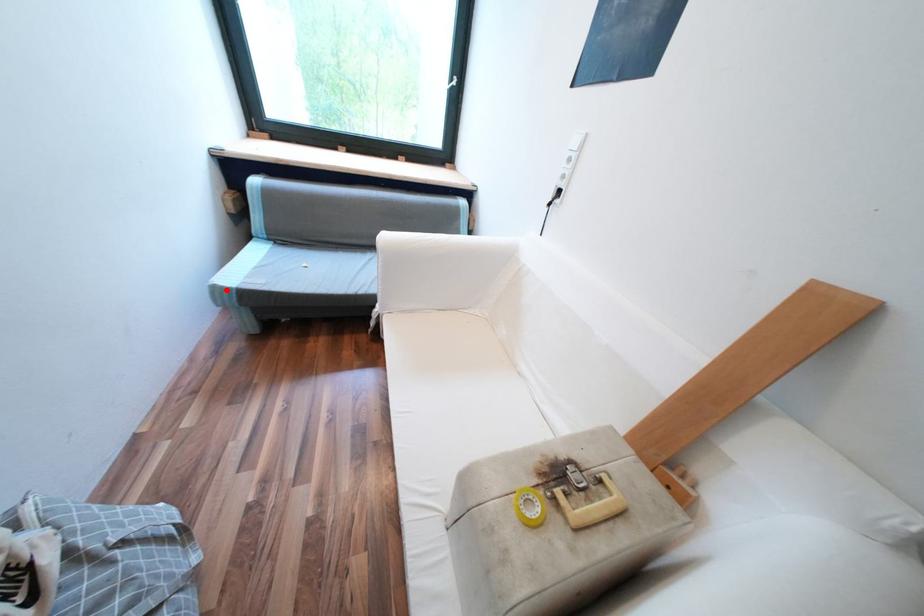
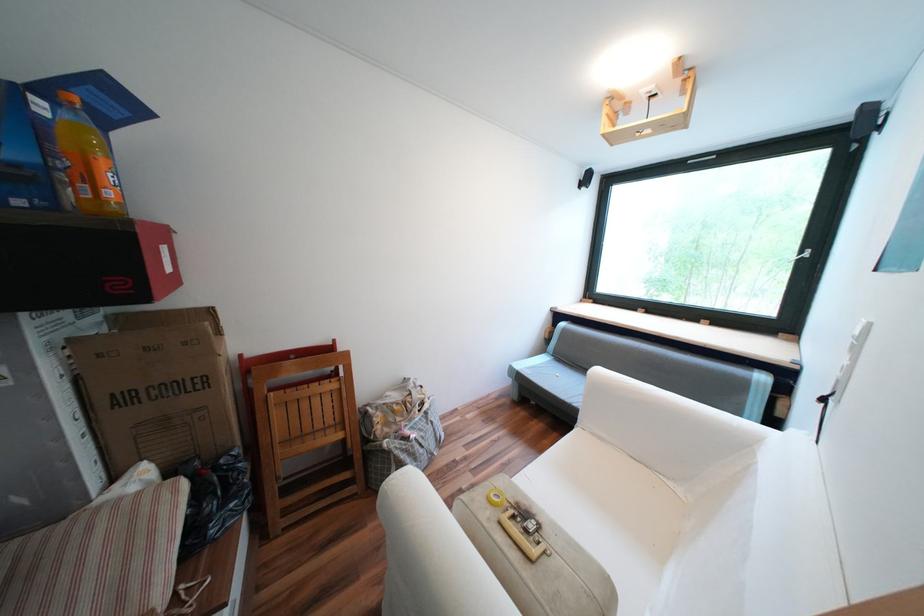
Question: I am providing you with two images of the same scene from different viewpoints. A red point is shown in image1. For the corresponding object point in image2, is it positioned nearer or farther from the camera?

Choices:
 (A) Nearer
 (B) Farther

Answer: (B)